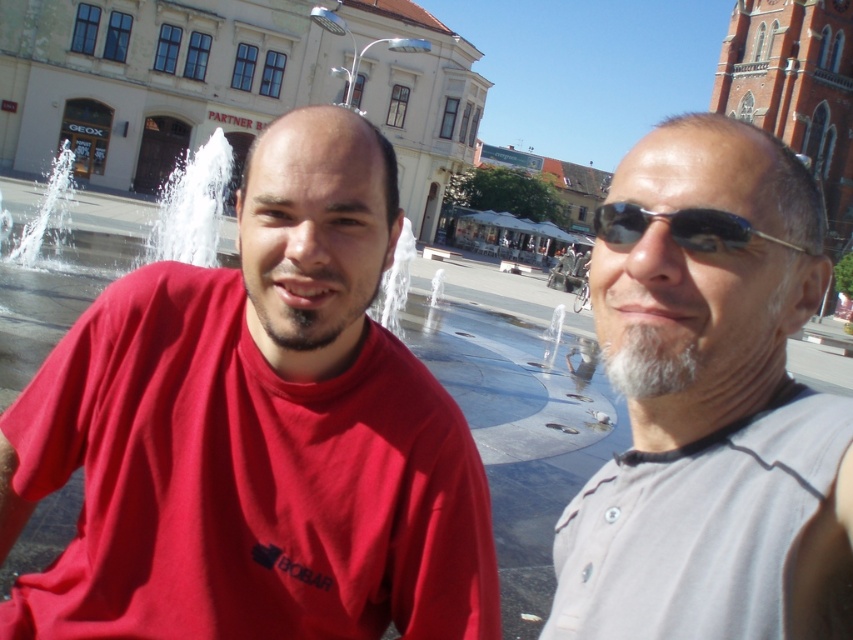
Question: Is dark brown stubble at left below black plastic sunglasses at right?

Choices:
 (A) yes
 (B) no

Answer: (A)

Question: Considering the real-world distances, which object is farthest from the black plastic sunglasses at right?

Choices:
 (A) gray fabric shirt at center
 (B) white fluffy beard at right
 (C) dark brown stubble at left
 (D) matte red t-shirt at center

Answer: (D)

Question: Which point is closer to the camera?

Choices:
 (A) gray fabric shirt at center
 (B) white fluffy beard at right

Answer: (A)

Question: Estimate the real-world distances between objects in this image. Which object is closer to the matte red t-shirt at center?

Choices:
 (A) dark brown stubble at left
 (B) gray fabric shirt at center
 (C) black plastic sunglasses at right
 (D) white fluffy beard at right

Answer: (A)

Question: Observing the image, what is the correct spatial positioning of dark brown stubble at left in reference to black plastic sunglasses at right?

Choices:
 (A) below
 (B) above

Answer: (A)

Question: Can you confirm if matte red t-shirt at center is positioned above black plastic sunglasses at right?

Choices:
 (A) yes
 (B) no

Answer: (B)